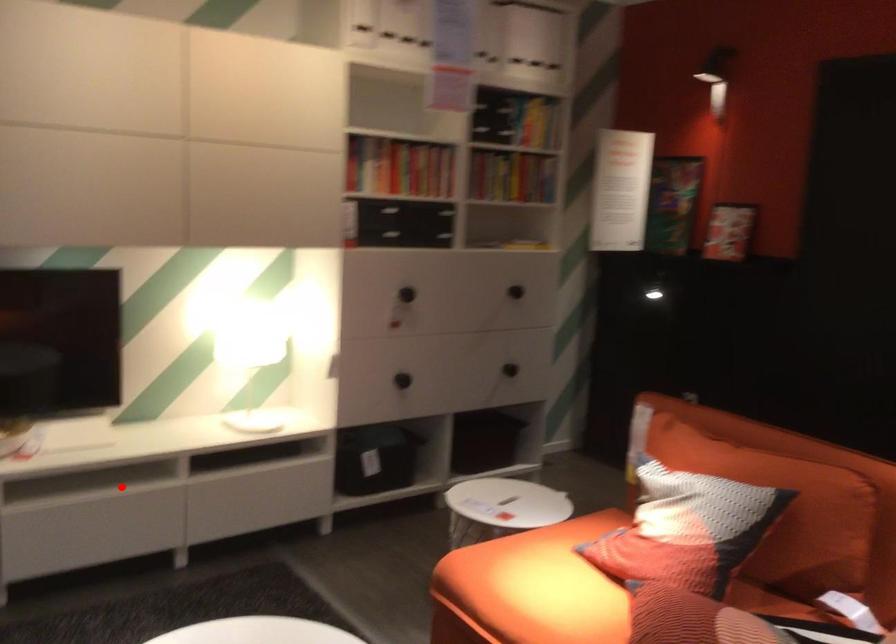
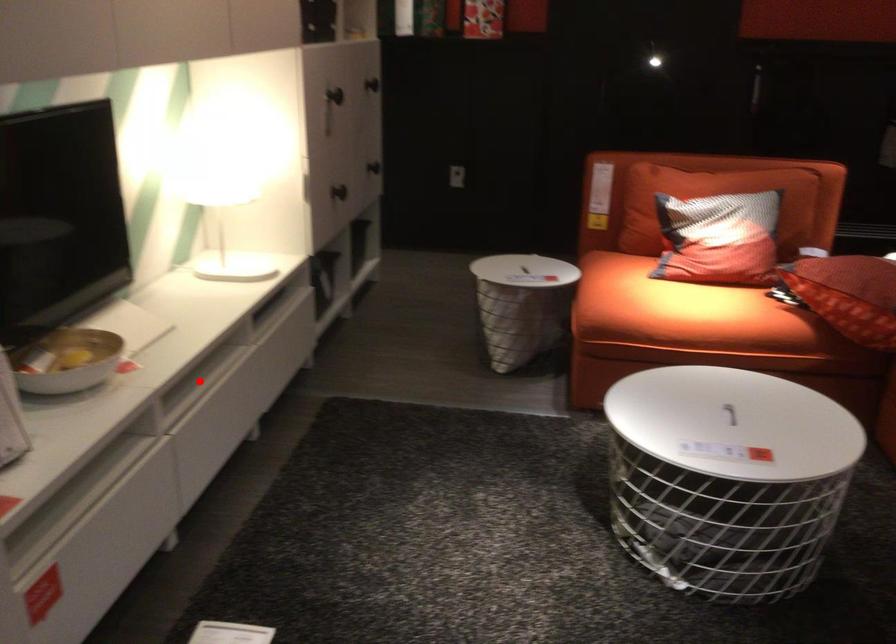
I am providing you with two images of the same scene from different viewpoints. A red point is marked on the first image and another point is marked on the second image. Are the points marked in image1 and image2 representing the same 3D position?

Yes